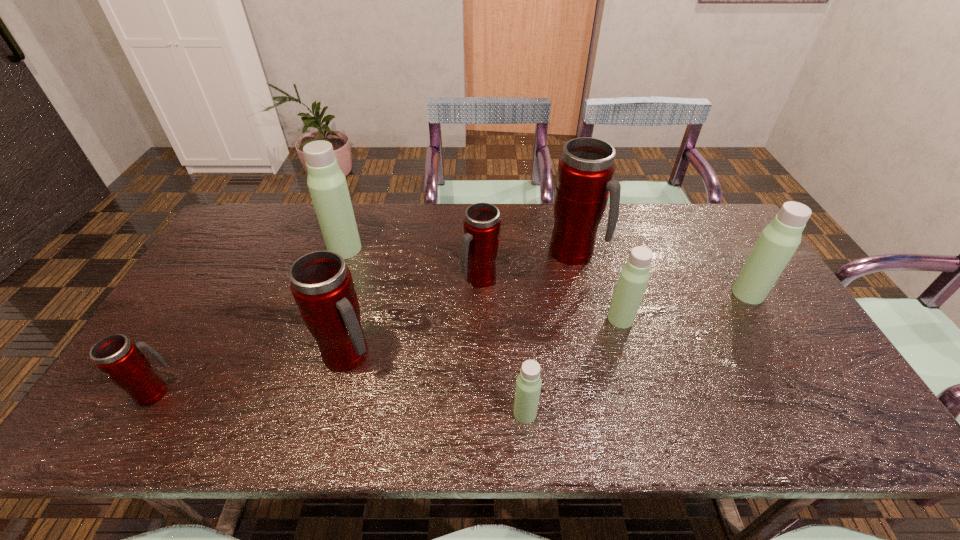
At what (x,y) coordinates should I click in order to perform the action: click on the farthest light thermos bottle. Please return your answer as a coordinate pair (x, y). Looking at the image, I should click on (327, 184).

At what (x,y) coordinates should I click in order to perform the action: click on the leftmost light thermos bottle. Please return your answer as a coordinate pair (x, y). Looking at the image, I should click on (327, 184).

Locate an element on the screen. The width and height of the screenshot is (960, 540). the biggest red thermos bottle is located at coordinates (586, 169).

You are a GUI agent. You are given a task and a screenshot of the screen. Output one action in this format:
    pyautogui.click(x=<x>, y=<y>)
    Task: Click on the rightmost thermos bottle
    Image resolution: width=960 pixels, height=540 pixels.
    Given the screenshot: What is the action you would take?
    pyautogui.click(x=778, y=241)

Identify the location of the rightmost light thermos bottle. Image resolution: width=960 pixels, height=540 pixels. (778, 241).

In order to click on the second biggest red thermos bottle in this screenshot , I will do `click(322, 286)`.

Where is `the second smallest red thermos bottle`? the second smallest red thermos bottle is located at coordinates (480, 246).

Identify the location of the fourth object from left to right. (480, 246).

Identify the location of the second light thermos bottle from right to left. This screenshot has height=540, width=960. (634, 276).

Locate an element on the screen. the fourth nearest thermos bottle is located at coordinates (634, 276).